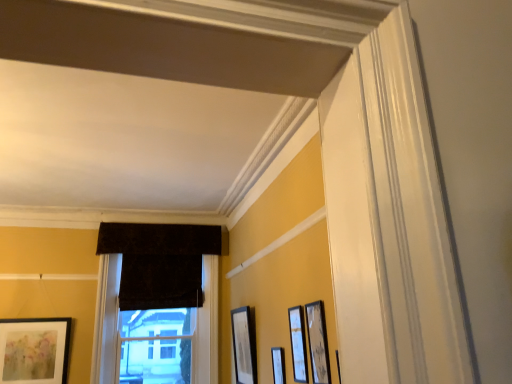
Question: Which direction should I rotate to look at matte black picture frame at center, the second picture frame viewed from the right?

Choices:
 (A) right
 (B) left

Answer: (A)

Question: Is dark velvet curtain at center thinner than velvet dark brown window at center?

Choices:
 (A) no
 (B) yes

Answer: (B)

Question: Is dark velvet curtain at center wider than velvet dark brown window at center?

Choices:
 (A) yes
 (B) no

Answer: (B)

Question: Can you confirm if dark velvet curtain at center is positioned to the left of velvet dark brown window at center?

Choices:
 (A) no
 (B) yes

Answer: (A)

Question: Is dark velvet curtain at center directly adjacent to velvet dark brown window at center?

Choices:
 (A) yes
 (B) no

Answer: (B)

Question: Is dark velvet curtain at center turned away from velvet dark brown window at center?

Choices:
 (A) no
 (B) yes

Answer: (B)

Question: From the image's perspective, does dark velvet curtain at center appear lower than velvet dark brown window at center?

Choices:
 (A) yes
 (B) no

Answer: (B)

Question: Is dark velvet curtain at center bigger than matte black picture frame at lower right, positioned as the 3th picture frame in front-to-back order?

Choices:
 (A) yes
 (B) no

Answer: (A)

Question: Is matte black picture frame at lower right, which is the third picture frame in left-to-right order, completely or partially inside dark velvet curtain at center?

Choices:
 (A) yes
 (B) no

Answer: (B)

Question: Is dark velvet curtain at center next to matte black picture frame at lower right, positioned as the 3th picture frame in front-to-back order, and touching it?

Choices:
 (A) yes
 (B) no

Answer: (B)

Question: Is matte black picture frame at lower right, the third picture frame in the right-to-left sequence, at the back of dark velvet curtain at center?

Choices:
 (A) no
 (B) yes

Answer: (A)

Question: From a real-world perspective, is dark velvet curtain at center under matte black picture frame at lower right, which is the third picture frame in left-to-right order?

Choices:
 (A) no
 (B) yes

Answer: (A)

Question: Is dark velvet curtain at center at the left side of matte black picture frame at lower right, the third picture frame in the right-to-left sequence?

Choices:
 (A) yes
 (B) no

Answer: (A)

Question: Can we say matte black picture frame at center, the 4th picture frame when ordered from left to right, lies outside dark velvet curtain at center?

Choices:
 (A) no
 (B) yes

Answer: (B)